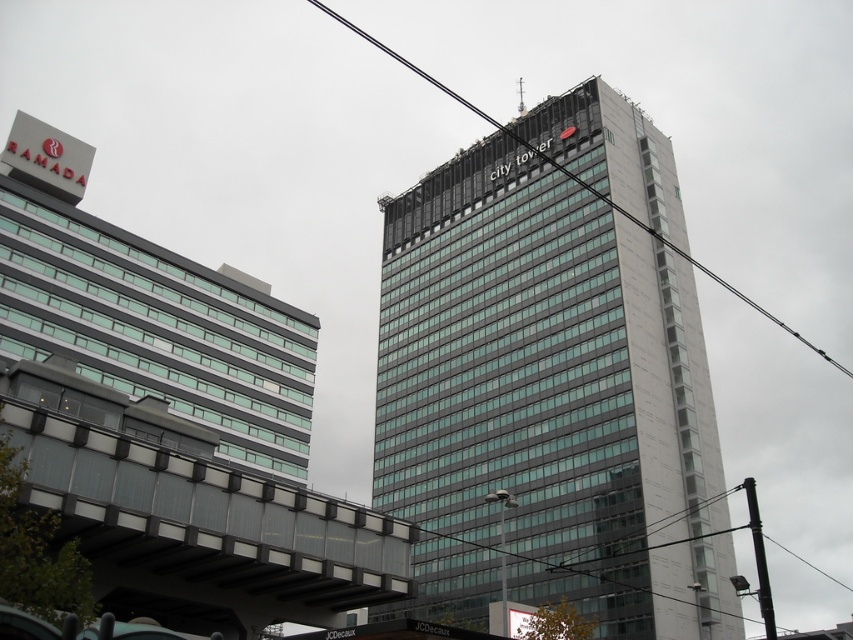
Can you confirm if glassy gray skyscraper at center is thinner than black wire at upper center?

Yes, glassy gray skyscraper at center is thinner than black wire at upper center.

Which is more to the right, glassy gray skyscraper at center or black wire at upper center?

Positioned to the right is black wire at upper center.

Find the location of a particular element. glassy gray skyscraper at center is located at coordinates (546, 403).

Locate an element on the screen. The image size is (853, 640). glassy gray skyscraper at center is located at coordinates (546, 403).

Is glassy gray skyscraper at center below black metallic pole at lower right?

Actually, glassy gray skyscraper at center is above black metallic pole at lower right.

Is glassy gray skyscraper at center shorter than black metallic pole at lower right?

Yes, glassy gray skyscraper at center is shorter than black metallic pole at lower right.

What do you see at coordinates (546, 403) in the screenshot? The height and width of the screenshot is (640, 853). I see `glassy gray skyscraper at center` at bounding box center [546, 403].

Identify the location of glassy gray skyscraper at center. Image resolution: width=853 pixels, height=640 pixels. (546, 403).

Between point (706, 273) and point (764, 621), which one is positioned behind?

The point (706, 273) is more distant.

Can you confirm if black wire at upper center is positioned to the right of black metallic pole at lower right?

In fact, black wire at upper center is to the left of black metallic pole at lower right.

Between point (601, 195) and point (759, 564), which one is positioned in front?

Positioned in front is point (601, 195).

You are a GUI agent. You are given a task and a screenshot of the screen. Output one action in this format:
    pyautogui.click(x=<x>, y=<y>)
    Task: Click on the black wire at upper center
    This screenshot has height=640, width=853.
    Given the screenshot: What is the action you would take?
    pyautogui.click(x=573, y=179)